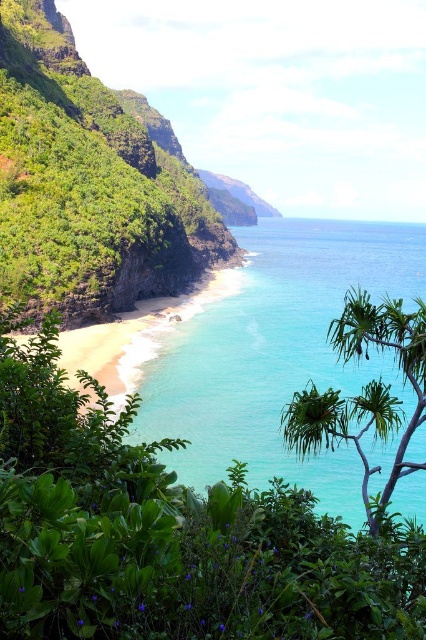
Image resolution: width=426 pixels, height=640 pixels. What do you see at coordinates (170, 532) in the screenshot? I see `green leafy shrubs at center` at bounding box center [170, 532].

Which of these two, green leafy shrubs at center or turquoise clear water at center, stands taller?

turquoise clear water at center

Is point (348, 544) positioned in front of point (206, 346)?

Yes.

This screenshot has width=426, height=640. I want to click on green leafy shrubs at center, so click(x=170, y=532).

Looking at this image, can you confirm if turquoise clear water at center is positioned to the left of green leafy hillside at left?

In fact, turquoise clear water at center is to the right of green leafy hillside at left.

Is point (368, 442) less distant than point (109, 138)?

Yes, it is in front of point (109, 138).

Where is `turquoise clear water at center`? Image resolution: width=426 pixels, height=640 pixels. turquoise clear water at center is located at coordinates (276, 353).

Between turquoise clear water at center and green leafy tree at center, which one appears on the left side from the viewer's perspective?

From the viewer's perspective, green leafy tree at center appears more on the left side.

Where is `turquoise clear water at center`? The image size is (426, 640). turquoise clear water at center is located at coordinates (276, 353).

Find the location of a particular element. The height and width of the screenshot is (640, 426). turquoise clear water at center is located at coordinates (276, 353).

The width and height of the screenshot is (426, 640). I want to click on turquoise clear water at center, so click(x=276, y=353).